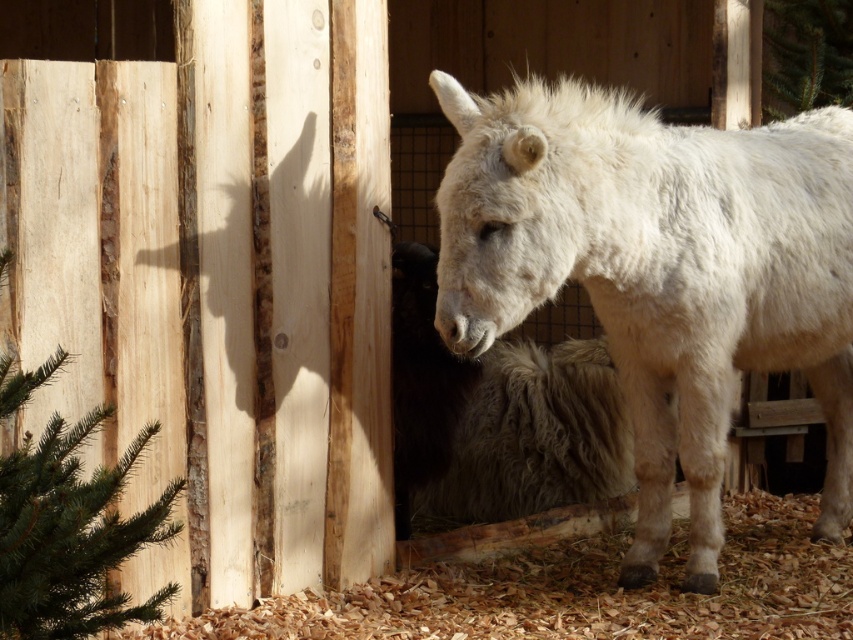
You are a farmer who needs to decide which animal to lead out first for feeding. Based on their sizes, which animal is taller between the white woolen donkey at center and the white woolly sheep at center?

The white woolen donkey at center is taller than the white woolly sheep at center, so you should lead the white woolen donkey at center first.

You are a farmer who wants to transport both the white woolen donkey at center and the white woolly sheep at center in a single trip using a small trailer that can only carry animals weighing up to 200 kg combined. If the donkey weighs 1.5 times the sheep, what is the maximum weight the sheep can weigh without exceeding the trailer capacity?

Let the sheep weigh x kg. The donkey weighs 1.5x. Total weight is x 1.5x 2.5x. 2.5x must be less than or equal to 200 kg. Solving for x gives x 80 kg. So the sheep must weigh no more than 80 kg.

You are a farmer who wants to separate the white woolen donkey at center and the white woolly sheep at center using a divider. Which animal should the divider be placed closer to in order to separate them effectively?

The divider should be placed closer to the white woolly sheep at center since the white woolen donkey at center is located above it, so placing the divider near the lower area where the sheep is would create separation between them.